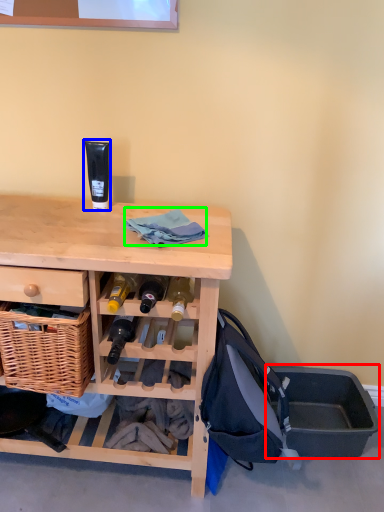
Question: Which is nearer to the storage box (highlighted by a red box)? toiletry (highlighted by a blue box) or clothing (highlighted by a green box).

Choices:
 (A) toiletry
 (B) clothing

Answer: (B)